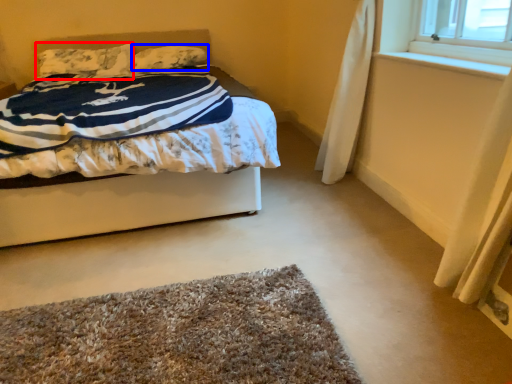
Question: Which object is further to the camera taking this photo, pillow (highlighted by a red box) or pillow (highlighted by a blue box)?

Choices:
 (A) pillow
 (B) pillow

Answer: (B)